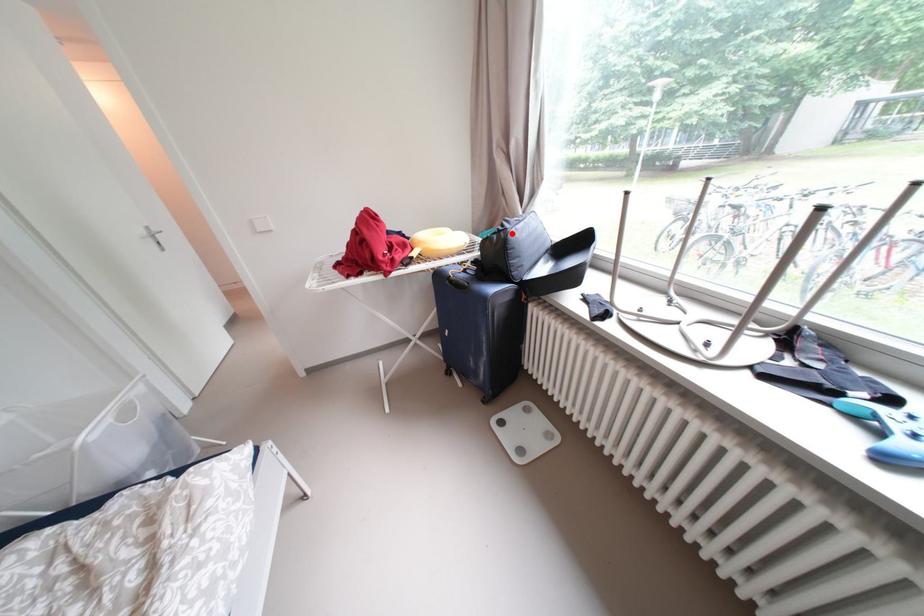
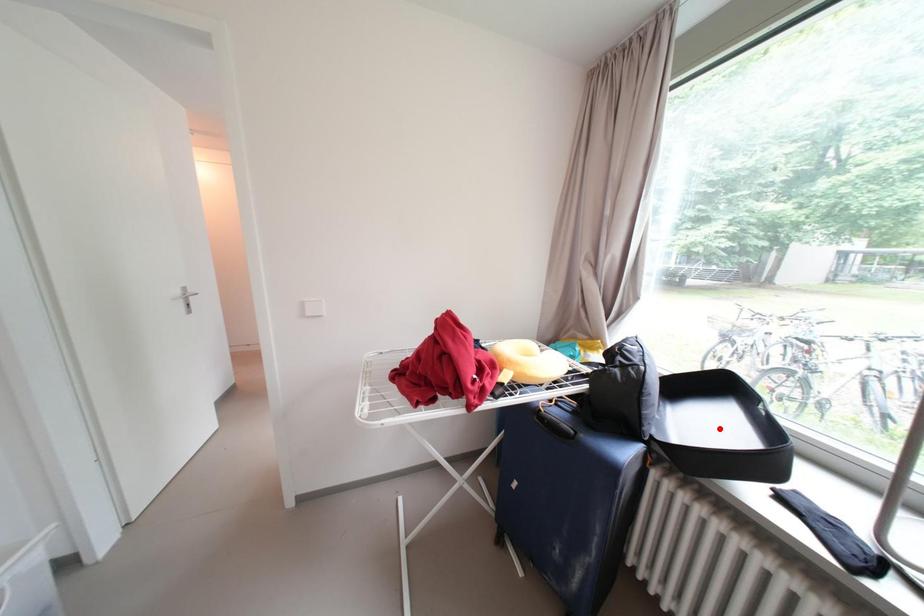
I am providing you with two images of the same scene from different viewpoints. A red point is marked on the first image and another point is marked on the second image. Is the red point in image1 aligned with the point shown in image2?

No